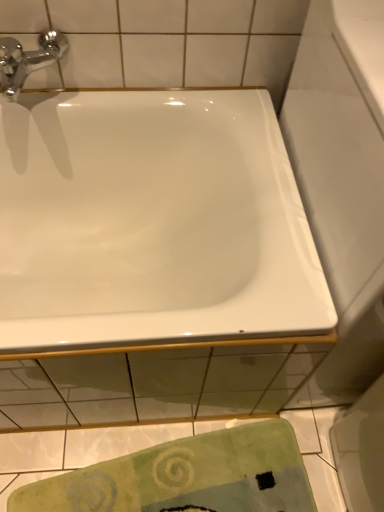
Measure the distance between chrome/metallic faucet at upper left and camera.

The distance of chrome/metallic faucet at upper left from camera is 89.63 centimeters.

In order to face white glossy bathtub at upper center, should I rotate leftwards or rightwards?

It's best to rotate left around 10.293 degrees.

The width and height of the screenshot is (384, 512). What do you see at coordinates (152, 223) in the screenshot? I see `white glossy bathtub at upper center` at bounding box center [152, 223].

The image size is (384, 512). Identify the location of green textured towel at lower center. (187, 477).

Identify the location of chrome/metallic faucet at upper left. This screenshot has height=512, width=384. (x=27, y=60).

How distant is white glossy bathtub at upper center from chrome/metallic faucet at upper left?

white glossy bathtub at upper center is 16.20 inches away from chrome/metallic faucet at upper left.

Is white glossy bathtub at upper center taller than chrome/metallic faucet at upper left?

Indeed, white glossy bathtub at upper center has a greater height compared to chrome/metallic faucet at upper left.

Considering the points (128, 268) and (14, 75), which point is in front, point (128, 268) or point (14, 75)?

The point (14, 75) is in front.

Based on the photo, from the image's perspective, is white glossy bathtub at upper center below chrome/metallic faucet at upper left?

Yes.

Between green textured towel at lower center and white glossy bathtub at upper center, which one appears on the right side from the viewer's perspective?

green textured towel at lower center.

Which is correct: green textured towel at lower center is inside white glossy bathtub at upper center, or outside of it?

green textured towel at lower center is outside white glossy bathtub at upper center.

Are green textured towel at lower center and white glossy bathtub at upper center far apart?

Actually, green textured towel at lower center and white glossy bathtub at upper center are a little close together.

Does white glossy bathtub at upper center have a smaller size compared to green textured towel at lower center?

No.

From the image's perspective, would you say white glossy bathtub at upper center is positioned over green textured towel at lower center?

Yes, from the image's perspective, white glossy bathtub at upper center is on top of green textured towel at lower center.

Considering the relative positions of white glossy bathtub at upper center and green textured towel at lower center in the image provided, is white glossy bathtub at upper center to the right of green textured towel at lower center from the viewer's perspective?

No, white glossy bathtub at upper center is not to the right of green textured towel at lower center.

Could green textured towel at lower center be considered to be inside white glossy bathtub at upper center?

That's incorrect, green textured towel at lower center is not inside white glossy bathtub at upper center.

Is green textured towel at lower center a part of chrome/metallic faucet at upper left?

No, green textured towel at lower center is not surrounded by chrome/metallic faucet at upper left.

Which is nearer, (5, 38) or (190, 495)?

The point (5, 38) is closer.

Would you say chrome/metallic faucet at upper left is a long distance from green textured towel at lower center?

Yes, chrome/metallic faucet at upper left is far from green textured towel at lower center.

Is chrome/metallic faucet at upper left at the right side of green textured towel at lower center?

In fact, chrome/metallic faucet at upper left is to the left of green textured towel at lower center.

Which object is further away from the camera, green textured towel at lower center or chrome/metallic faucet at upper left?

green textured towel at lower center is behind.

From the image's perspective, which is below, green textured towel at lower center or chrome/metallic faucet at upper left?

green textured towel at lower center.

Is point (161, 461) farther from camera compared to point (22, 51)?

Yes, point (161, 461) is farther from viewer.

Which object is thinner, green textured towel at lower center or chrome/metallic faucet at upper left?

chrome/metallic faucet at upper left.

Is chrome/metallic faucet at upper left turned away from white glossy bathtub at upper center?

No, chrome/metallic faucet at upper left's orientation is not away from white glossy bathtub at upper center.

Based on the photo, from the image's perspective, would you say chrome/metallic faucet at upper left is shown under white glossy bathtub at upper center?

No, from the image's perspective, chrome/metallic faucet at upper left is not beneath white glossy bathtub at upper center.

Considering the relative sizes of chrome/metallic faucet at upper left and white glossy bathtub at upper center in the image provided, is chrome/metallic faucet at upper left smaller than white glossy bathtub at upper center?

Indeed, chrome/metallic faucet at upper left has a smaller size compared to white glossy bathtub at upper center.

In the scene shown: Would you say chrome/metallic faucet at upper left is outside white glossy bathtub at upper center?

Yes.

At what (x,y) coordinates should I click in order to perform the action: click on bathtub located below the chrome/metallic faucet at upper left (from the image's perspective). Please return your answer as a coordinate pair (x, y). Looking at the image, I should click on (152, 223).

This screenshot has height=512, width=384. In order to click on beach towel behind the white glossy bathtub at upper center in this screenshot , I will do `click(187, 477)`.

When comparing their distances from white glossy bathtub at upper center, does green textured towel at lower center or chrome/metallic faucet at upper left seem further?

Based on the image, green textured towel at lower center appears to be further to white glossy bathtub at upper center.

Estimate the real-world distances between objects in this image. Which object is further from green textured towel at lower center, chrome/metallic faucet at upper left or white glossy bathtub at upper center?

→ chrome/metallic faucet at upper left.

Based on their spatial positions, is white glossy bathtub at upper center or green textured towel at lower center closer to chrome/metallic faucet at upper left?

The object closer to chrome/metallic faucet at upper left is white glossy bathtub at upper center.

From the image, which object appears to be nearer to green textured towel at lower center, white glossy bathtub at upper center or chrome/metallic faucet at upper left?

white glossy bathtub at upper center lies closer to green textured towel at lower center than the other object.

Looking at the image, which one is located closer to chrome/metallic faucet at upper left, green textured towel at lower center or white glossy bathtub at upper center?

Among the two, white glossy bathtub at upper center is located nearer to chrome/metallic faucet at upper left.

Based on their spatial positions, is chrome/metallic faucet at upper left or green textured towel at lower center further from white glossy bathtub at upper center?

green textured towel at lower center is further to white glossy bathtub at upper center.

At what (x,y) coordinates should I click in order to perform the action: click on bathtub between chrome/metallic faucet at upper left and green textured towel at lower center from top to bottom. Please return your answer as a coordinate pair (x, y). Image resolution: width=384 pixels, height=512 pixels. Looking at the image, I should click on (152, 223).